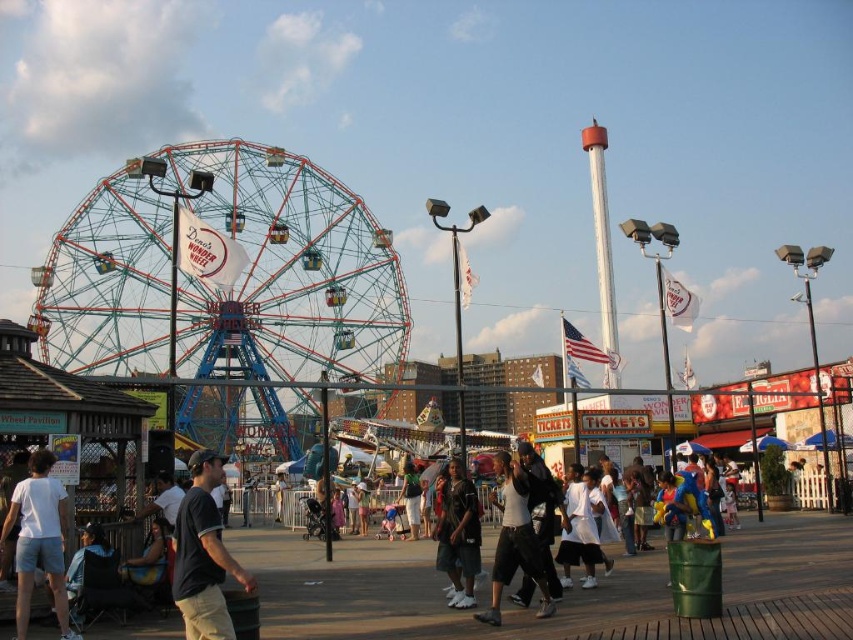
Question: Does white cotton crowd at center have a greater width compared to dark gray pants at center?

Choices:
 (A) no
 (B) yes

Answer: (B)

Question: Among these objects, which one is nearest to the camera?

Choices:
 (A) dark gray pants at center
 (B) white cotton crowd at center
 (C) dark blue cotton shirt at center
 (D) dark blue jeans at center

Answer: (B)

Question: Can you confirm if dark gray pants at center is positioned below dark blue jeans at center?

Choices:
 (A) yes
 (B) no

Answer: (A)

Question: Where is dark blue cotton shirt at center located in relation to white cotton shirt at lower left in the image?

Choices:
 (A) left
 (B) right

Answer: (B)

Question: Considering the real-world distances, which object is farthest from the white cotton crowd at center?

Choices:
 (A) white cotton shirt at lower left
 (B) dark gray pants at center
 (C) dark blue jeans at center

Answer: (A)

Question: Which of the following is the closest to the observer?

Choices:
 (A) dark blue cotton shirt at center
 (B) dark gray pants at center
 (C) metallic wire ferris wheel at center

Answer: (A)